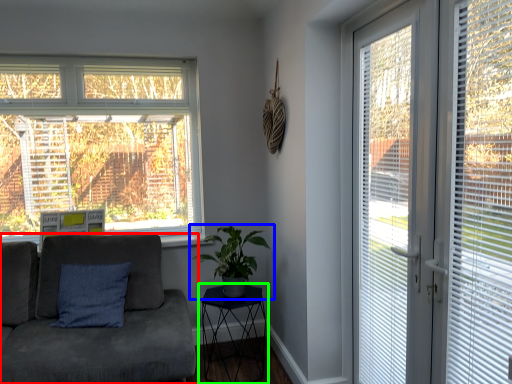
Question: Which object is positioned closest to studio couch (highlighted by a red box)? Select from houseplant (highlighted by a blue box) and table (highlighted by a green box).

Choices:
 (A) houseplant
 (B) table

Answer: (A)